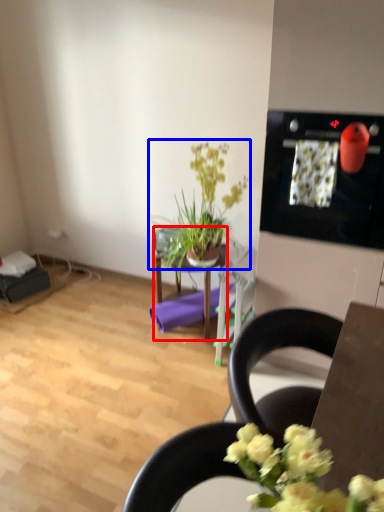
Question: Among these objects, which one is farthest to the camera, table (highlighted by a red box) or houseplant (highlighted by a blue box)?

Choices:
 (A) table
 (B) houseplant

Answer: (A)